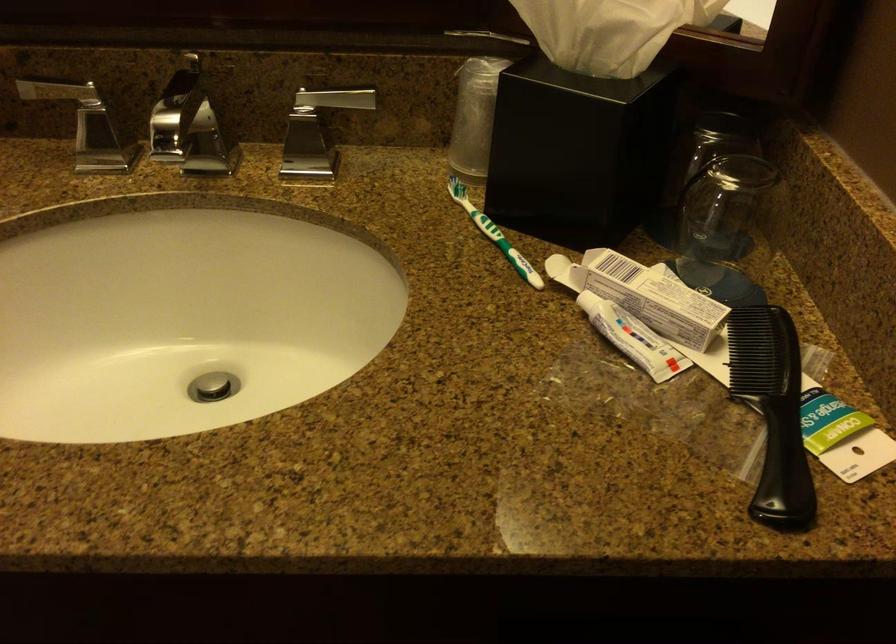
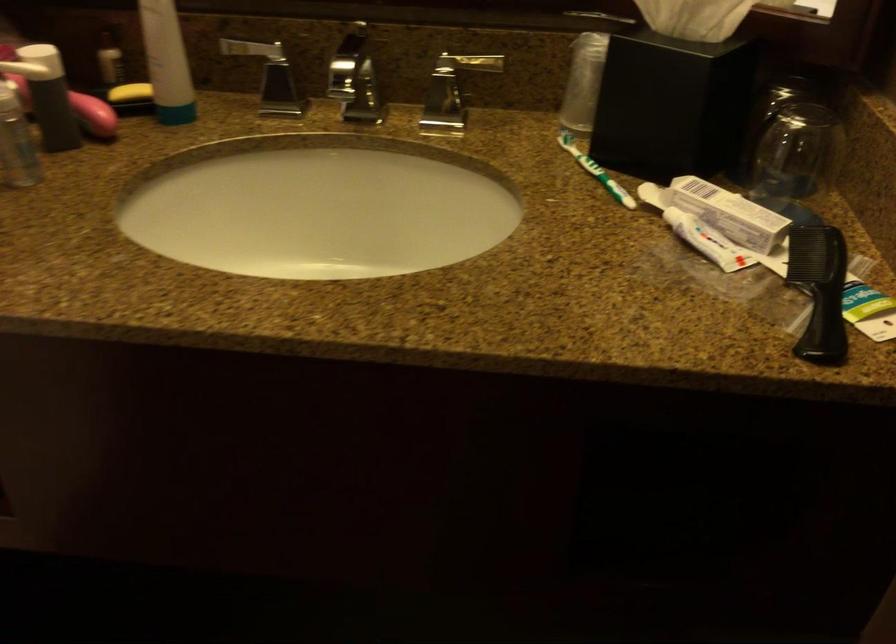
Question: The camera is either moving clockwise (left) or counter-clockwise (right) around the object. The first image is from the beginning of the video and the second image is from the end. Is the camera moving left or right when shooting the video?

Choices:
 (A) Left
 (B) Right

Answer: (B)